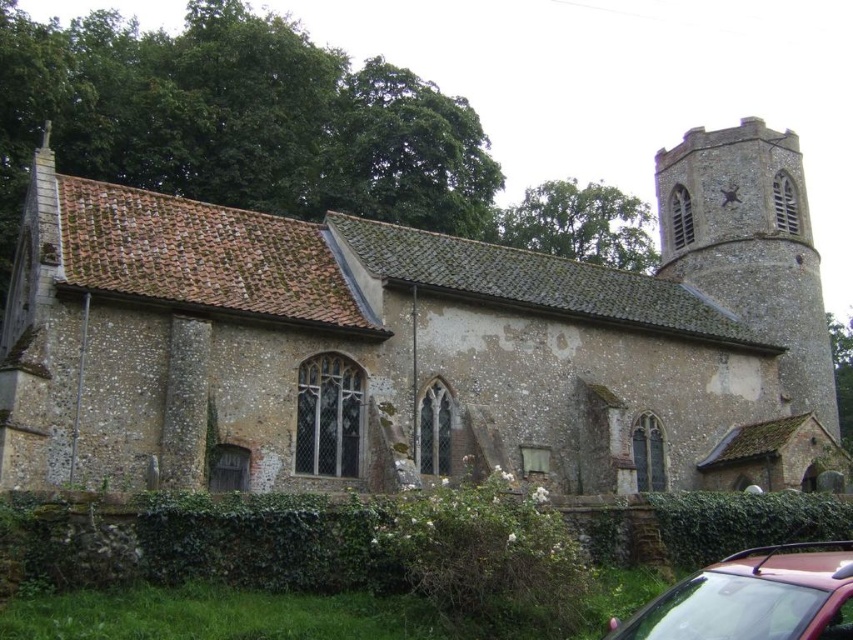
You are standing in front of the old stone church at center. There is a point marked at coordinates (418, 342). Can you tell me what part of the church this point is located on?

The point at coordinates (418, 342) is located on the stone church at center.

You are standing in front of the old stone church. There is a stone steeple marked by point (750, 246). Where is this point located relative to the church?

The point (750, 246) marks the stone steeple at the upper right of the church.